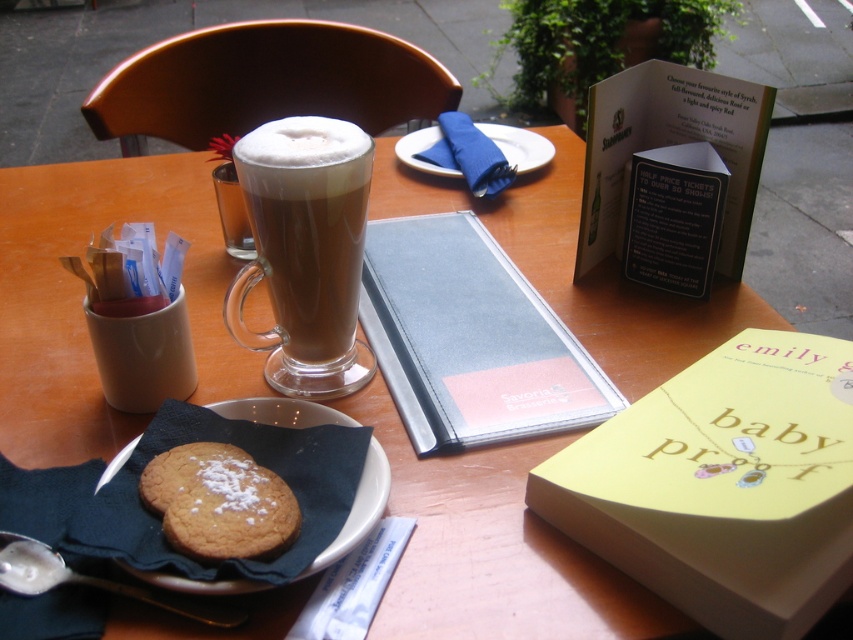
Question: Is sugar-coated cookie at lower left smaller than powdered sugar cookie at center?

Choices:
 (A) no
 (B) yes

Answer: (A)

Question: Among these objects, which one is nearest to the camera?

Choices:
 (A) white ceramic plate at center
 (B) brown frothy latte at center
 (C) sugar-coated cookie at lower left
 (D) powdered sugar cookie at center

Answer: (C)

Question: Is sugar-coated cookie at lower left smaller than white ceramic plate at center?

Choices:
 (A) no
 (B) yes

Answer: (B)

Question: Which object is the closest to the yellow paperback book at center?

Choices:
 (A) white ceramic saucer at lower left
 (B) brown frothy latte at center
 (C) sugar-coated cookie at lower left

Answer: (A)

Question: Among these objects, which one is nearest to the camera?

Choices:
 (A) yellow paperback book at center
 (B) blue leather menu at center
 (C) sugar-coated cookie at lower left
 (D) powdered sugar cookie at center

Answer: (A)

Question: Does yellow paperback book at center have a smaller size compared to sugar-coated cookie at lower left?

Choices:
 (A) yes
 (B) no

Answer: (B)